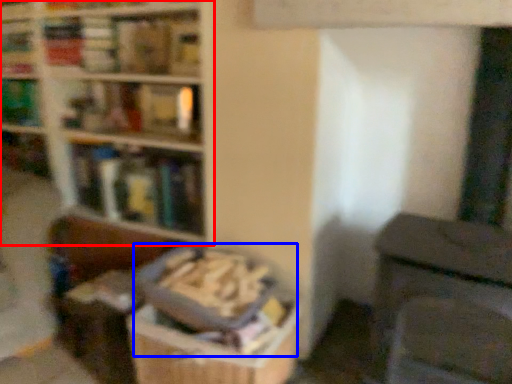
Question: Which of the following is the farthest to the observer, bookcase (highlighted by a red box) or book (highlighted by a blue box)?

Choices:
 (A) bookcase
 (B) book

Answer: (A)